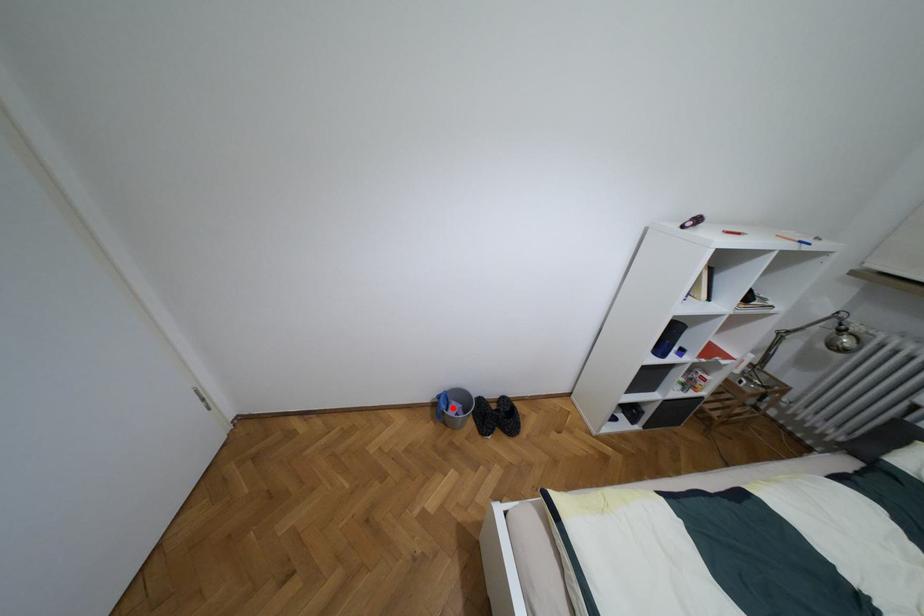
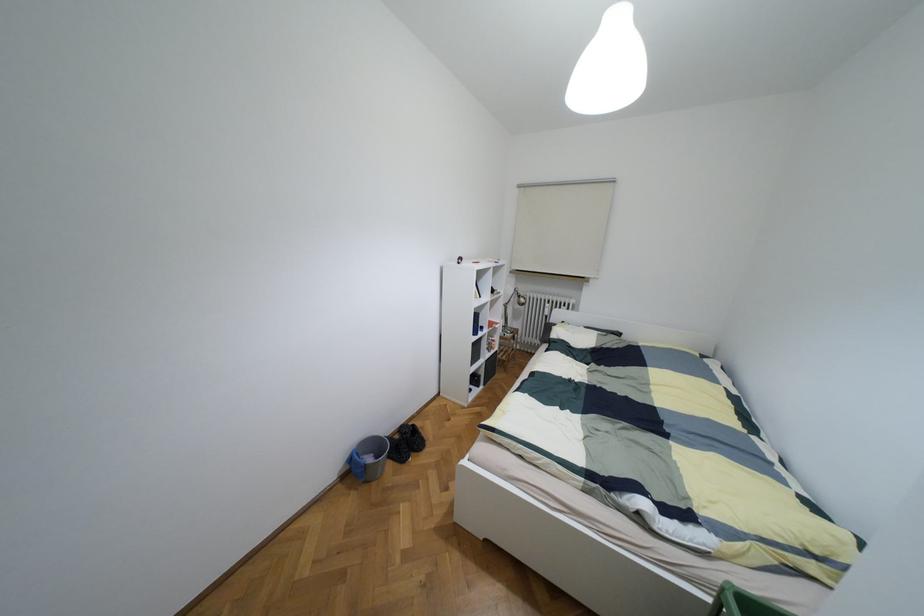
Where in the second image is the point corresponding to the highlighted location from the first image?

(369, 459)